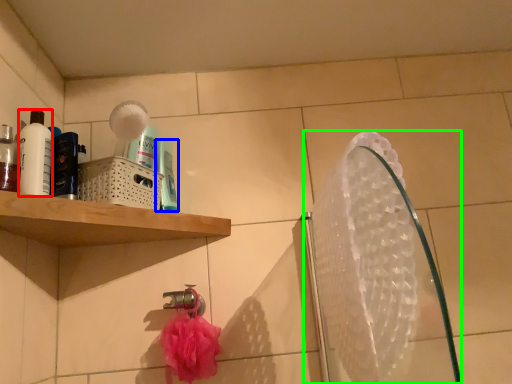
Question: Considering the real-world distances, which object is farthest from mouthwash (highlighted by a red box)? mouthwash (highlighted by a blue box) or mirror (highlighted by a green box)?

Choices:
 (A) mouthwash
 (B) mirror

Answer: (B)